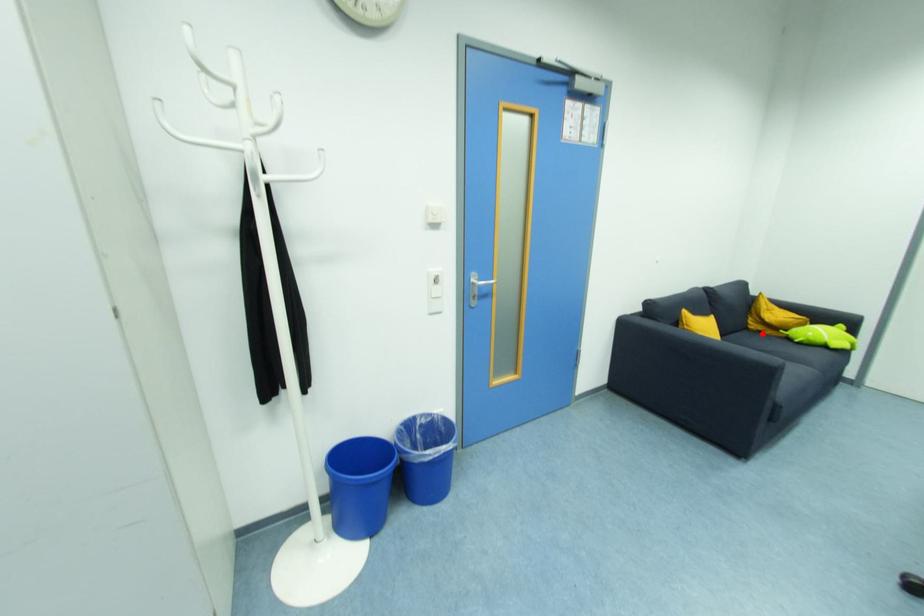
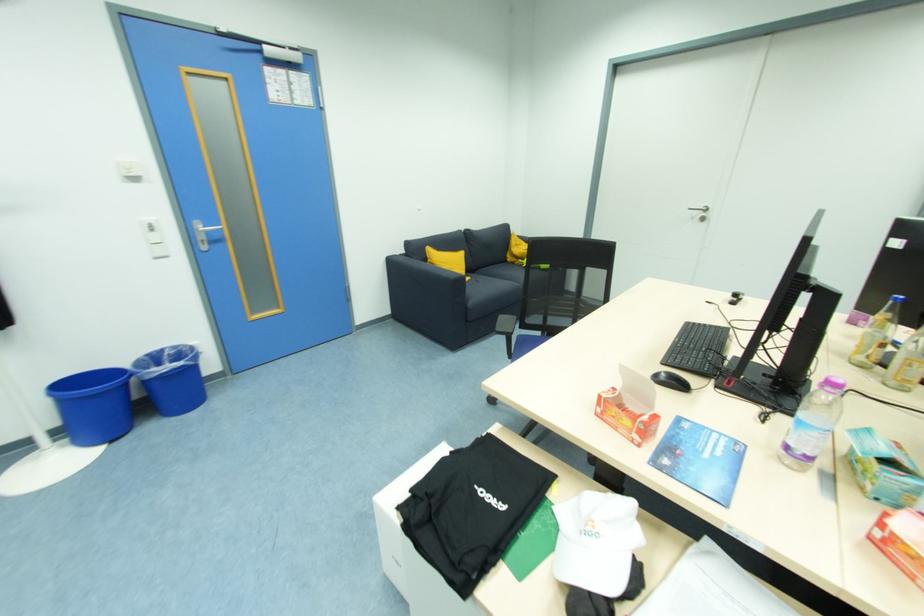
The point at the highlighted location is marked in the first image. Where is the corresponding point in the second image?

(516, 265)